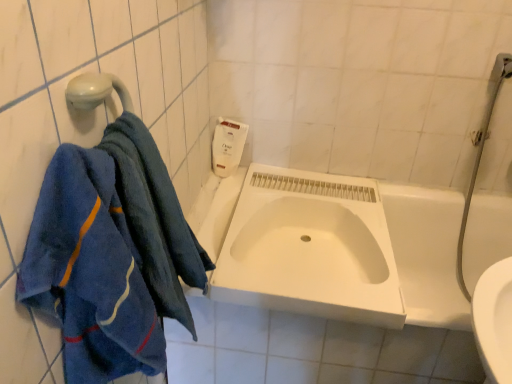
Question: From a real-world perspective, is white plastic soap dispenser at upper center beneath white matte sink at center?

Choices:
 (A) yes
 (B) no

Answer: (B)

Question: Is white plastic soap dispenser at upper center turned away from white matte sink at center?

Choices:
 (A) no
 (B) yes

Answer: (A)

Question: Considering the relative sizes of white plastic soap dispenser at upper center and white matte sink at center in the image provided, is white plastic soap dispenser at upper center shorter than white matte sink at center?

Choices:
 (A) yes
 (B) no

Answer: (B)

Question: Is the depth of white plastic soap dispenser at upper center less than that of white matte sink at center?

Choices:
 (A) no
 (B) yes

Answer: (A)

Question: Does white plastic soap dispenser at upper center contain white matte sink at center?

Choices:
 (A) yes
 (B) no

Answer: (B)

Question: In terms of size, does white matte sink at center appear bigger or smaller than blue terry cloth towel at left, which is the second towel in front-to-back order?

Choices:
 (A) small
 (B) big

Answer: (B)

Question: Is white matte sink at center wider or thinner than blue terry cloth towel at left, which is the second towel in front-to-back order?

Choices:
 (A) thin
 (B) wide

Answer: (B)

Question: Would you say white matte sink at center is inside or outside blue terry cloth towel at left, positioned as the 1th towel in back-to-front order?

Choices:
 (A) outside
 (B) inside

Answer: (A)

Question: Considering the positions of point (254, 269) and point (143, 172), is point (254, 269) closer or farther from the camera than point (143, 172)?

Choices:
 (A) closer
 (B) farther

Answer: (B)

Question: Visually, is white matte sink at center positioned to the left or to the right of blue terry cloth towel at left, marked as the first towel in a front-to-back arrangement?

Choices:
 (A) left
 (B) right

Answer: (B)

Question: Is point (325, 311) positioned closer to the camera than point (143, 312)?

Choices:
 (A) farther
 (B) closer

Answer: (A)

Question: Is white matte sink at center spatially inside blue terry cloth towel at left, positioned as the 2th towel in back-to-front order, or outside of it?

Choices:
 (A) outside
 (B) inside

Answer: (A)

Question: Based on their sizes in the image, would you say white matte sink at center is bigger or smaller than blue terry cloth towel at left, marked as the first towel in a front-to-back arrangement?

Choices:
 (A) big
 (B) small

Answer: (A)

Question: From a real-world perspective, is blue terry cloth towel at left, positioned as the 2th towel in back-to-front order, physically located above or below white matte sink at center?

Choices:
 (A) below
 (B) above

Answer: (B)

Question: In the image, is blue terry cloth towel at left, marked as the first towel in a front-to-back arrangement, positioned in front of or behind white matte sink at center?

Choices:
 (A) front
 (B) behind

Answer: (A)